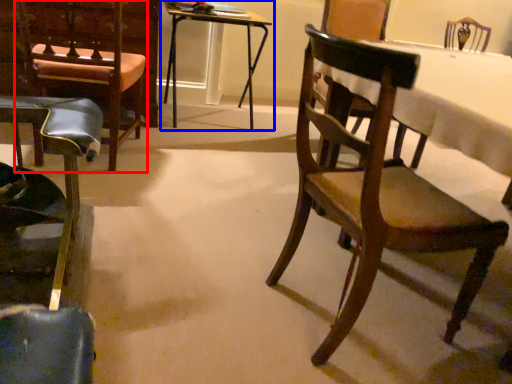
Question: Which object appears farthest to the camera in this image, armchair (highlighted by a red box) or table (highlighted by a blue box)?

Choices:
 (A) armchair
 (B) table

Answer: (B)